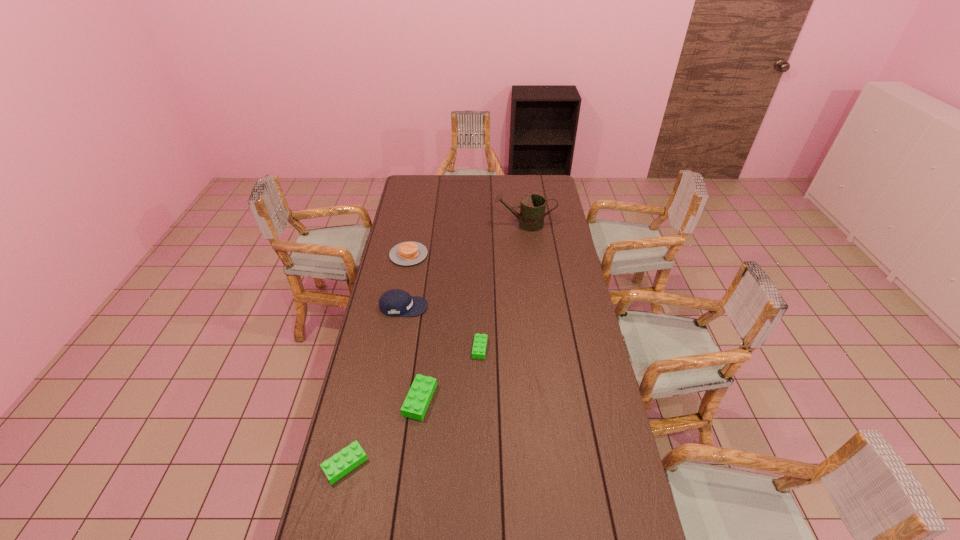
Image resolution: width=960 pixels, height=540 pixels. What are the coordinates of `vacant area between the nearest Lego and the baseball cap` in the screenshot? It's located at (374, 386).

Image resolution: width=960 pixels, height=540 pixels. Identify the location of free point between the shortest Lego and the baseball cap. (442, 327).

This screenshot has width=960, height=540. What are the coordinates of `vacant space that is in between the fifth nearest object and the second shortest Lego` in the screenshot? It's located at (377, 360).

This screenshot has width=960, height=540. I want to click on vacant space in between the shortest object and the pancake, so click(x=444, y=301).

This screenshot has height=540, width=960. I want to click on free space between the fifth nearest object and the leftmost Lego, so click(377, 360).

Identify the location of empty location between the fourth nearest object and the watering can. (464, 266).

Where is `vacant area that lies between the second farthest object and the tallest object`? vacant area that lies between the second farthest object and the tallest object is located at coordinates (467, 239).

Select which object is the third closest to the second tallest object. Please provide its 2D coordinates. Your answer should be formatted as a tuple, i.e. [(x, y)], where the tuple contains the x and y coordinates of a point satisfying the conditions above.

[(422, 389)]

Locate an element on the screen. The image size is (960, 540). object identified as the second closest to the second nearest object is located at coordinates (480, 340).

Image resolution: width=960 pixels, height=540 pixels. In order to click on the second closest Lego to the leftmost Lego in this screenshot , I will do `click(480, 340)`.